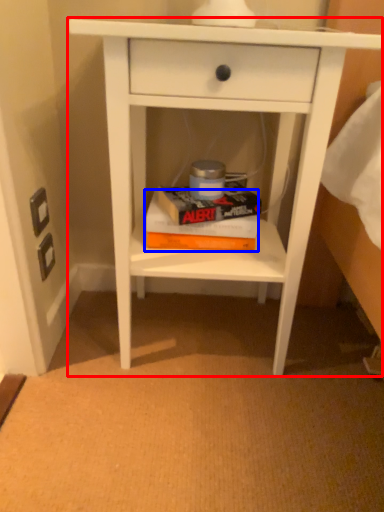
Question: Which of the following is the farthest to the observer, nightstand (highlighted by a red box) or paperback book (highlighted by a blue box)?

Choices:
 (A) nightstand
 (B) paperback book

Answer: (B)